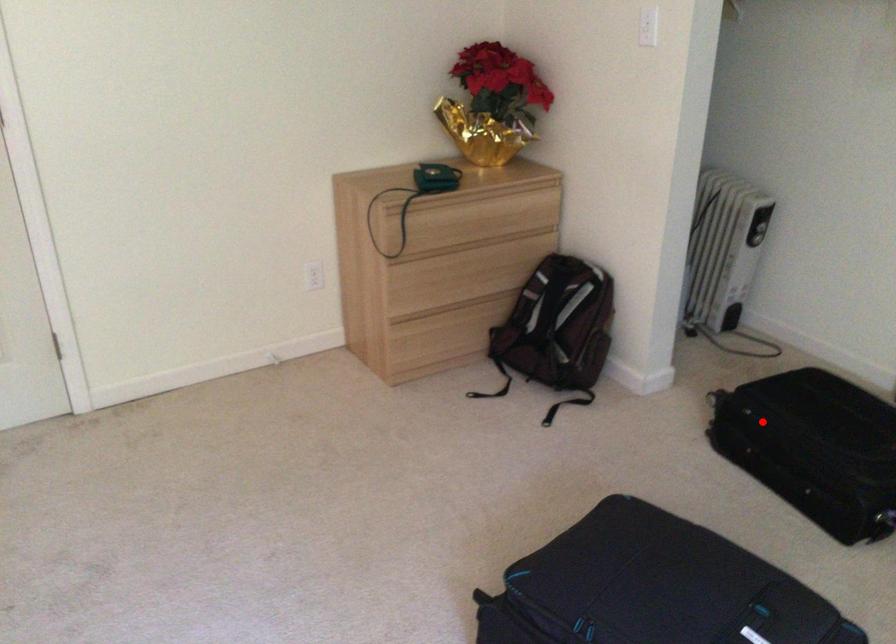
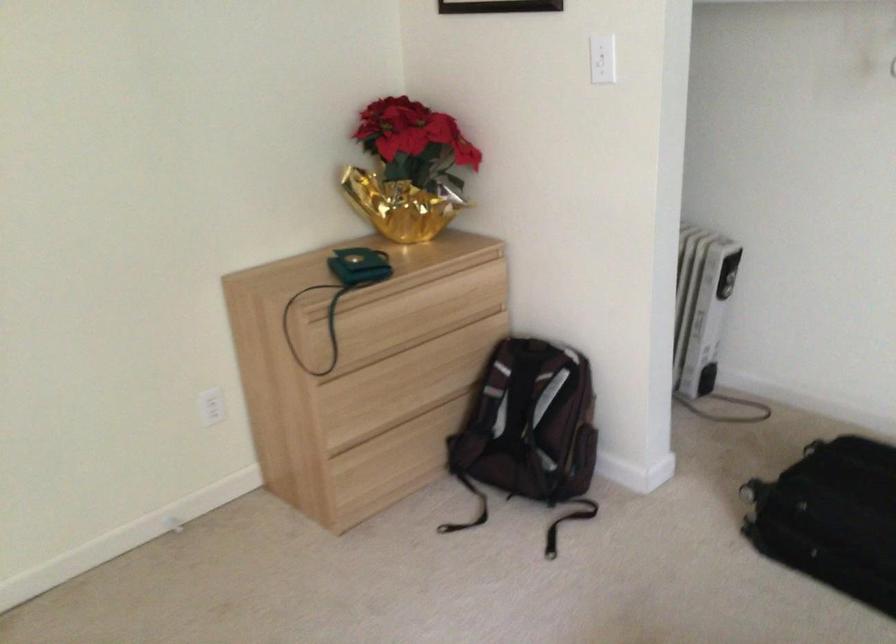
Question: A red point is marked in image1. In image2, is the corresponding 3D point closer to the camera or farther? Reply with the corresponding letter.

Choices:
 (A) The corresponding 3D point is closer.
 (B) The corresponding 3D point is farther.

Answer: (A)